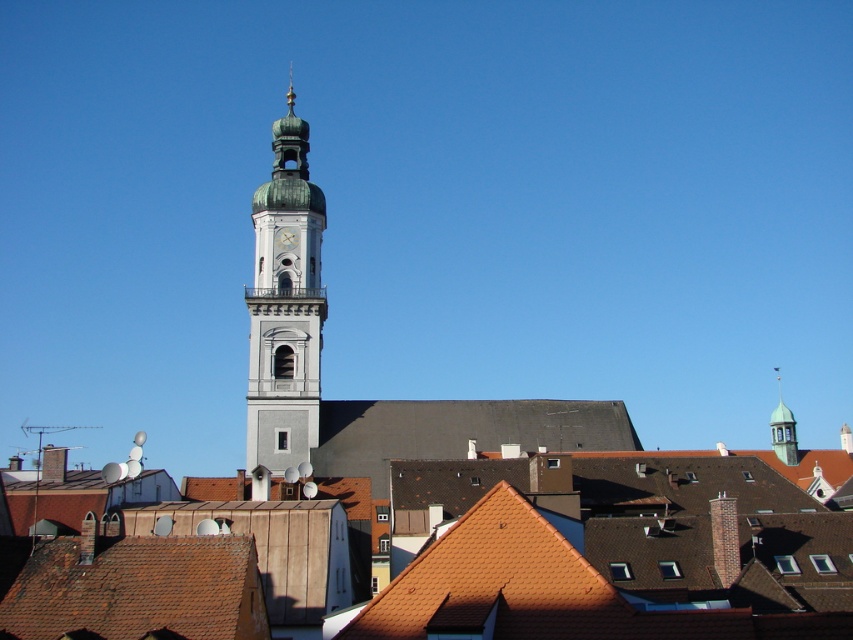
You are an architect designing a new building that needs to match the scale of the existing structures in the scene. Given the green polished dome at center and the green copper bell tower at upper right, which one should you reference for a smaller structure?

The green polished dome at center has a smaller width than the green copper bell tower at upper right, so you should reference the green polished dome at center for a smaller structure.

You are a photographer trying to capture the entire white glossy clock at center and the green copper bell tower at upper right in a single shot. Based on their sizes, do you think both can fit in the frame without cropping?

The green copper bell tower at upper right might be wider than the white glossy clock at center, so there is a possibility that the bell tower could be wider and may require adjusting the camera angle or zoom to ensure both fit in the frame.

You are standing in the middle of the urban scene and want to take a photo of the green polished dome at center. Based on its position, where should you aim your camera to capture it in the frame?

The green polished dome at center is located at the coordinates 0.478 on the x axis and 0.335 on the y axis, so you should aim your camera towards the center of the image slightly to the right and lower portion to capture it.